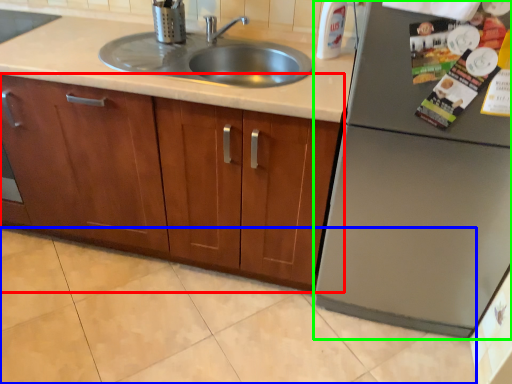
Question: Estimate the real-world distances between objects in this image. Which object is farther from cabinetry (highlighted by a red box), granite (highlighted by a blue box) or appliance (highlighted by a green box)?

Choices:
 (A) granite
 (B) appliance

Answer: (B)